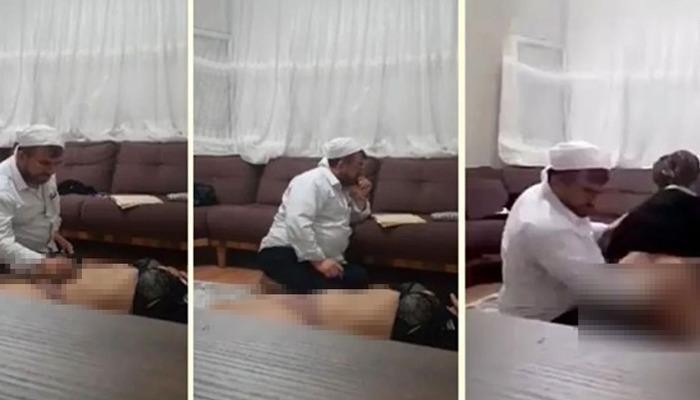
At what (x,y) coordinates should I click in order to perform the action: click on curtain. Please return your answer as a coordinate pair (x, y). The width and height of the screenshot is (700, 400). Looking at the image, I should click on (97, 87), (260, 85), (592, 104).